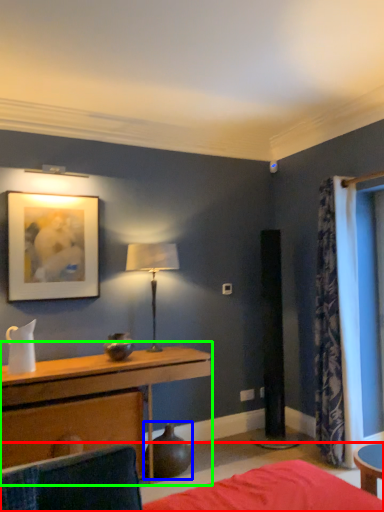
Question: Considering the real-world distances, which object is closest to bed (highlighted by a red box)? vase (highlighted by a blue box) or table (highlighted by a green box).

Choices:
 (A) vase
 (B) table

Answer: (B)